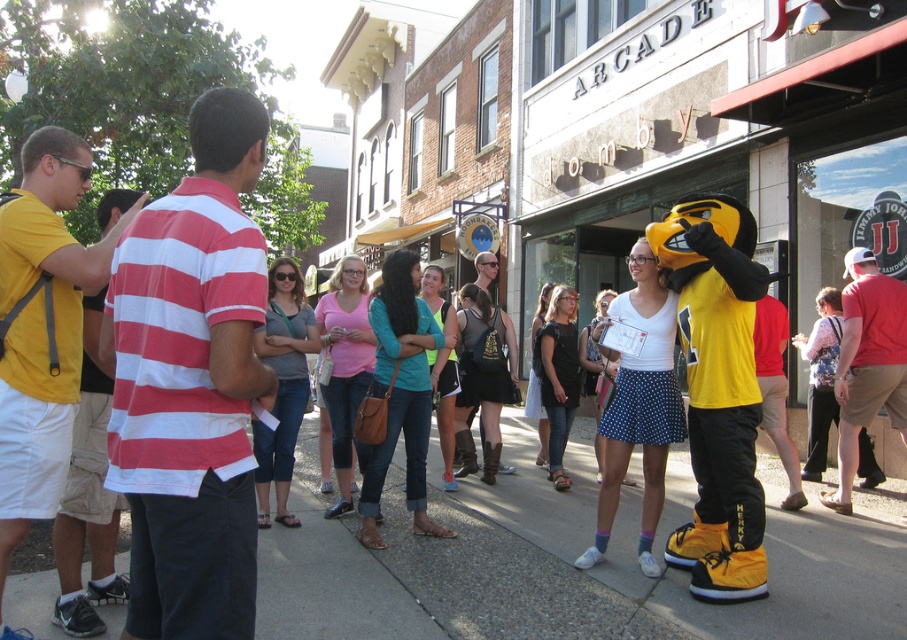
Question: From the image, what is the correct spatial relationship of gray concrete sidewalk at center in relation to yellow matte shirt at left?

Choices:
 (A) right
 (B) left

Answer: (A)

Question: Which object appears farthest from the camera in this image?

Choices:
 (A) gray concrete sidewalk at center
 (B) red and white striped polo shirt at left

Answer: (A)

Question: Does red and white striped polo shirt at left come behind yellow matte shirt at left?

Choices:
 (A) yes
 (B) no

Answer: (B)

Question: Is gray concrete sidewalk at center to the left of denim shorts at center from the viewer's perspective?

Choices:
 (A) yes
 (B) no

Answer: (A)

Question: Which point is closer to the camera?

Choices:
 (A) (307, 444)
 (B) (839, 484)

Answer: (B)

Question: Among these points, which one is farthest from the camera?

Choices:
 (A) (395, 602)
 (B) (215, 115)

Answer: (A)